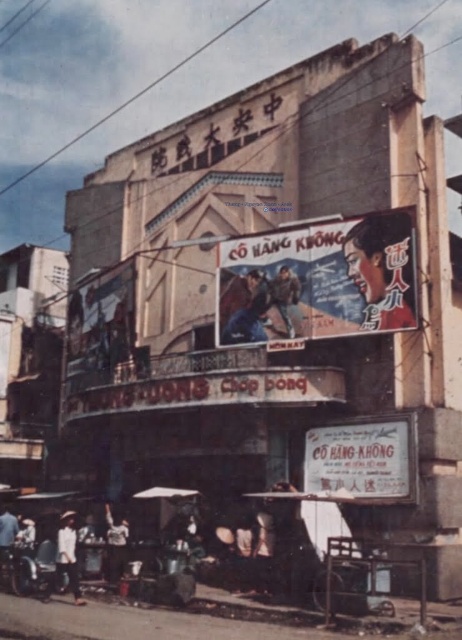
Does white paper billboard at center have a lesser height compared to smooth plastic face at center?

In fact, white paper billboard at center may be taller than smooth plastic face at center.

Who is higher up, white paper billboard at center or smooth plastic face at center?

smooth plastic face at center is higher up.

Describe the element at coordinates (364, 458) in the screenshot. I see `white paper billboard at center` at that location.

Find the location of a particular element. This screenshot has width=462, height=640. white paper billboard at center is located at coordinates (364, 458).

Can you confirm if smooth plastic face at center is positioned above light brown wooden cart at lower left?

Yes.

Does smooth plastic face at center come in front of light brown wooden cart at lower left?

Yes, smooth plastic face at center is in front of light brown wooden cart at lower left.

I want to click on smooth plastic face at center, so click(383, 268).

Does white paper billboard at center appear on the right side of dark blue fabric at center?

Yes, white paper billboard at center is to the right of dark blue fabric at center.

What do you see at coordinates (364, 458) in the screenshot? This screenshot has width=462, height=640. I see `white paper billboard at center` at bounding box center [364, 458].

This screenshot has width=462, height=640. What are the coordinates of `white paper billboard at center` in the screenshot? It's located at click(364, 458).